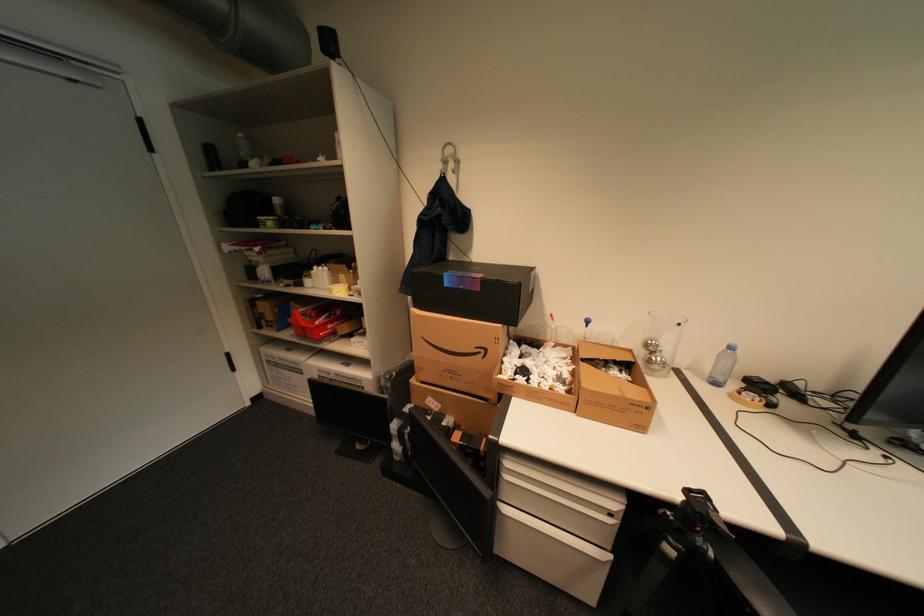
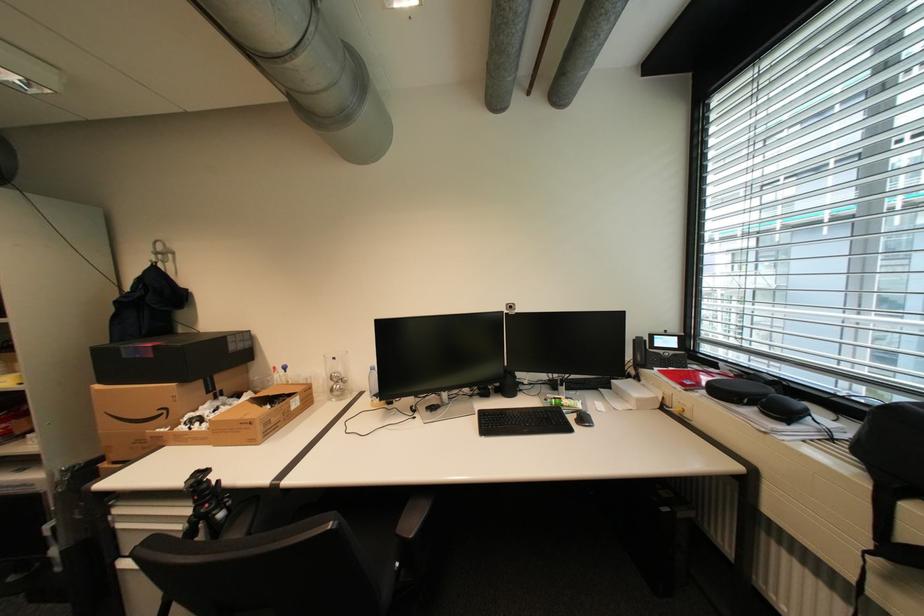
Where in the second image is the point corresponding to point 487,291 from the first image?

(161, 357)